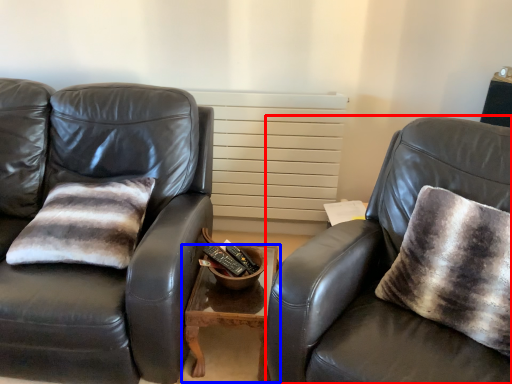
Question: Which point is further to the camera, chair (highlighted by a red box) or table (highlighted by a blue box)?

Choices:
 (A) chair
 (B) table

Answer: (B)